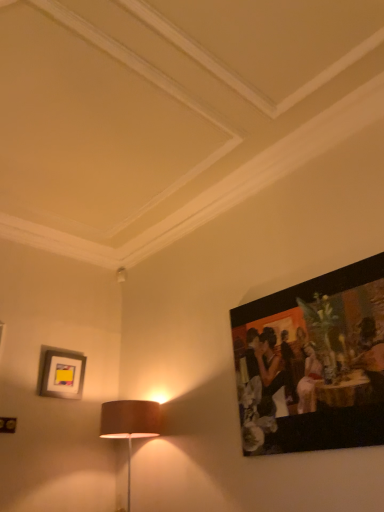
Question: Is matte yellow picture frame at upper left, which is the first picture frame from back to front, in front of or behind matte black painting at upper right, which ranks as the 1th picture frame in front-to-back order, in the image?

Choices:
 (A) front
 (B) behind

Answer: (B)

Question: From a real-world perspective, is matte yellow picture frame at upper left, marked as the 1th picture frame in a left-to-right arrangement, above or below matte black painting at upper right, the 1th picture frame positioned from the right?

Choices:
 (A) above
 (B) below

Answer: (A)

Question: Based on their positions, is matte yellow picture frame at upper left, placed as the second picture frame when sorted from front to back, located to the left or right of matte black painting at upper right, positioned as the 2th picture frame in back-to-front order?

Choices:
 (A) right
 (B) left

Answer: (B)

Question: Based on their positions, is matte black painting at upper right, positioned as the 2th picture frame in back-to-front order, located to the left or right of matte yellow picture frame at upper left, positioned as the 2th picture frame in right-to-left order?

Choices:
 (A) right
 (B) left

Answer: (A)

Question: Is matte black painting at upper right, the second picture frame when ordered from left to right, bigger or smaller than matte yellow picture frame at upper left, which is the first picture frame from back to front?

Choices:
 (A) big
 (B) small

Answer: (A)

Question: From the image's perspective, relative to matte yellow picture frame at upper left, positioned as the 2th picture frame in right-to-left order, is matte black painting at upper right, which ranks as the 1th picture frame in front-to-back order, above or below?

Choices:
 (A) above
 (B) below

Answer: (A)

Question: In the image, is matte black painting at upper right, the 1th picture frame positioned from the right, positioned in front of or behind matte yellow picture frame at upper left, placed as the second picture frame when sorted from front to back?

Choices:
 (A) behind
 (B) front

Answer: (B)